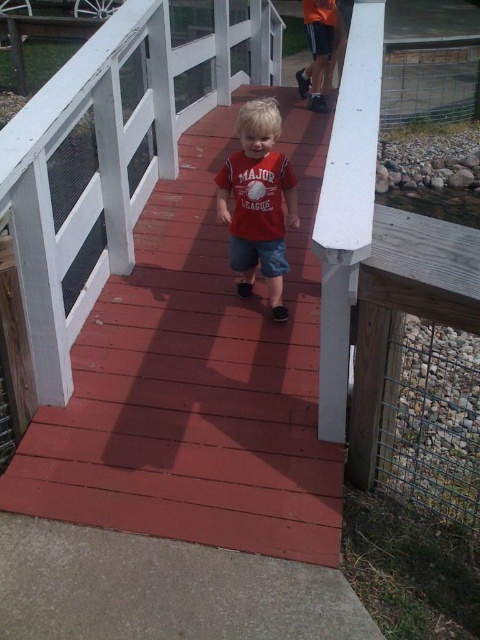
Question: Where is red wood deck at center located in relation to matte red shirt at center in the image?

Choices:
 (A) above
 (B) below

Answer: (B)

Question: Is red wood deck at center closer to camera compared to matte red shirt at center?

Choices:
 (A) yes
 (B) no

Answer: (A)

Question: Among these objects, which one is farthest from the camera?

Choices:
 (A) red wood deck at center
 (B) matte red shirt at center

Answer: (B)

Question: Which point is closer to the camera?

Choices:
 (A) (311, 346)
 (B) (288, 216)

Answer: (A)

Question: Among these objects, which one is farthest from the camera?

Choices:
 (A) matte red shirt at center
 (B) red wood deck at center

Answer: (A)

Question: Does red wood deck at center appear over matte red shirt at center?

Choices:
 (A) yes
 (B) no

Answer: (B)